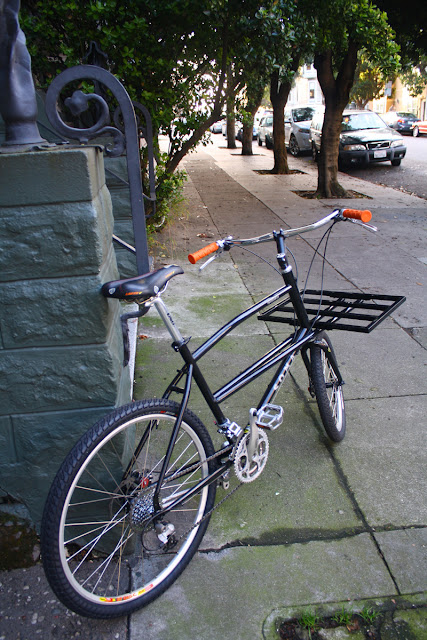
The height and width of the screenshot is (640, 427). Identify the location of wall. (44, 378).